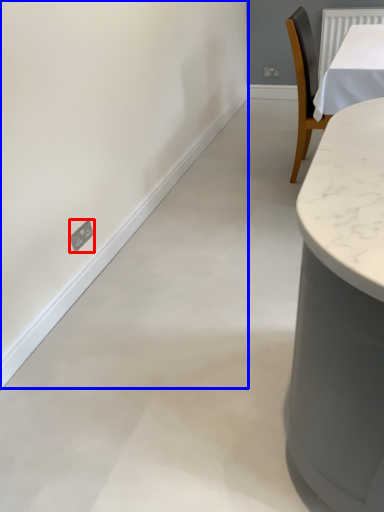
Question: Among these objects, which one is nearest to the camera, electric outlet (highlighted by a red box) or backdrop (highlighted by a blue box)?

Choices:
 (A) electric outlet
 (B) backdrop

Answer: (B)